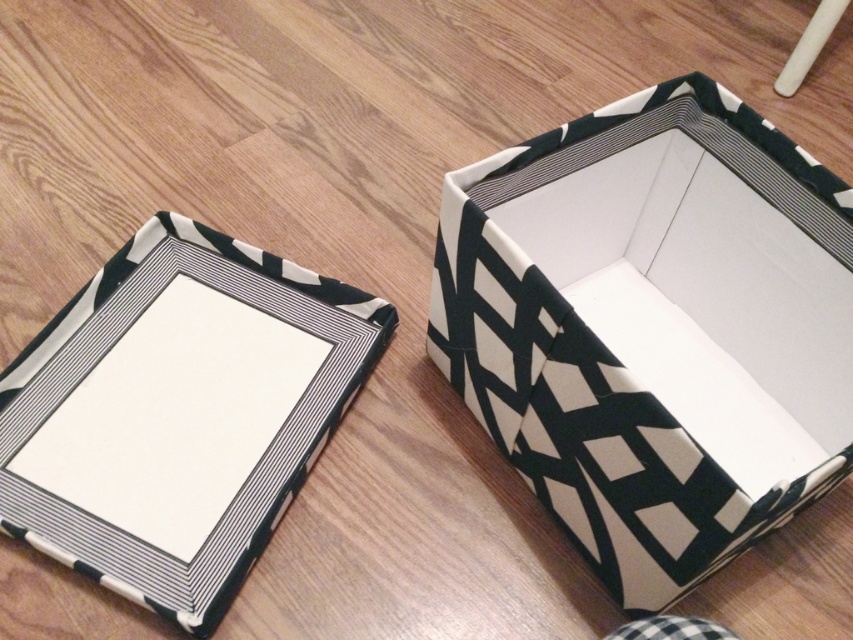
You are organizing storage boxes in a room and see the black and white patterned cardboard box at center and the black and white patterned box at center. Which one is nearer to you?

The black and white patterned cardboard box at center is closer to the viewer than the black and white patterned box at center.

You are a delivery robot that needs to place a package in the black and white patterned cardboard box at center. The package requires 30 inches of space in front of the box to be placed. Is there enough space?

The black and white patterned cardboard box at center is 27.25 inches away from the camera, which means there is insufficient space to place the package requiring 30 inches of space in front of it.

You are organizing your closet and need to place a small decorative item on top of the boxes. Which box should you choose between the black and white patterned cardboard box at center and the black and white patterned box at center?

The black and white patterned cardboard box at center is above the black and white patterned box at center, so placing the item on the upper box will ensure it stays in place.